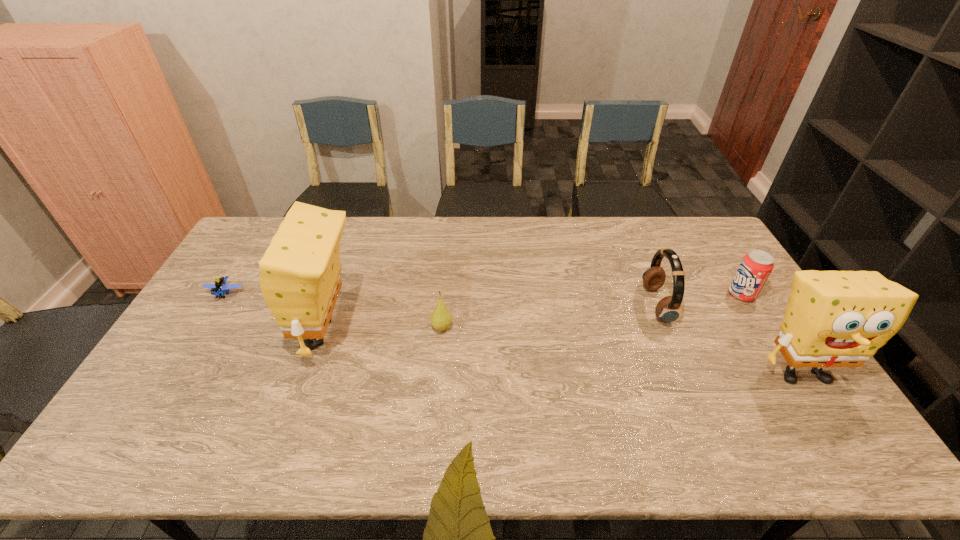
Where is `the tallest object`? The width and height of the screenshot is (960, 540). the tallest object is located at coordinates (300, 280).

This screenshot has height=540, width=960. In order to click on the taller sponge in this screenshot , I will do `click(300, 280)`.

I want to click on the shorter sponge, so click(x=833, y=318).

Find the location of a particular element. The width and height of the screenshot is (960, 540). the right sponge is located at coordinates (833, 318).

The height and width of the screenshot is (540, 960). In order to click on the fourth object from left to right in this screenshot , I will do (668, 309).

Identify the location of headset. (668, 309).

The height and width of the screenshot is (540, 960). I want to click on soda can, so click(756, 266).

Find the location of a particular element. the leftmost object is located at coordinates (x=220, y=286).

Where is `Lego`? The width and height of the screenshot is (960, 540). Lego is located at coordinates (220, 286).

Locate an element on the screen. This screenshot has height=540, width=960. the fourth object from right to left is located at coordinates (440, 319).